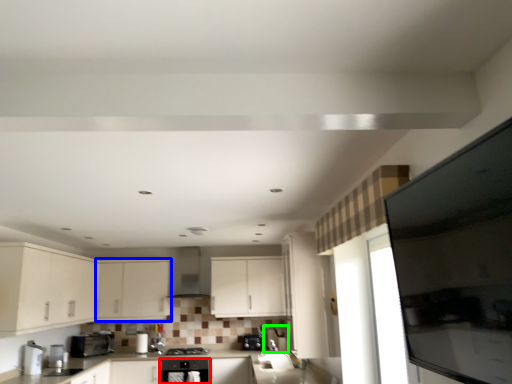
Question: Considering the real-world distances, which object is farthest from home appliance (highlighted by a red box)? cabinetry (highlighted by a blue box) or appliance (highlighted by a green box)?

Choices:
 (A) cabinetry
 (B) appliance

Answer: (A)